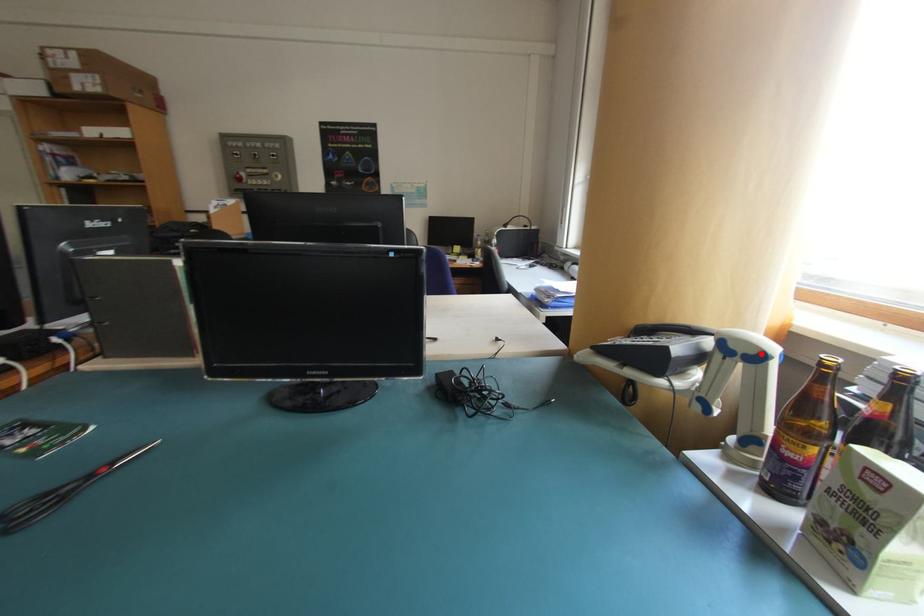
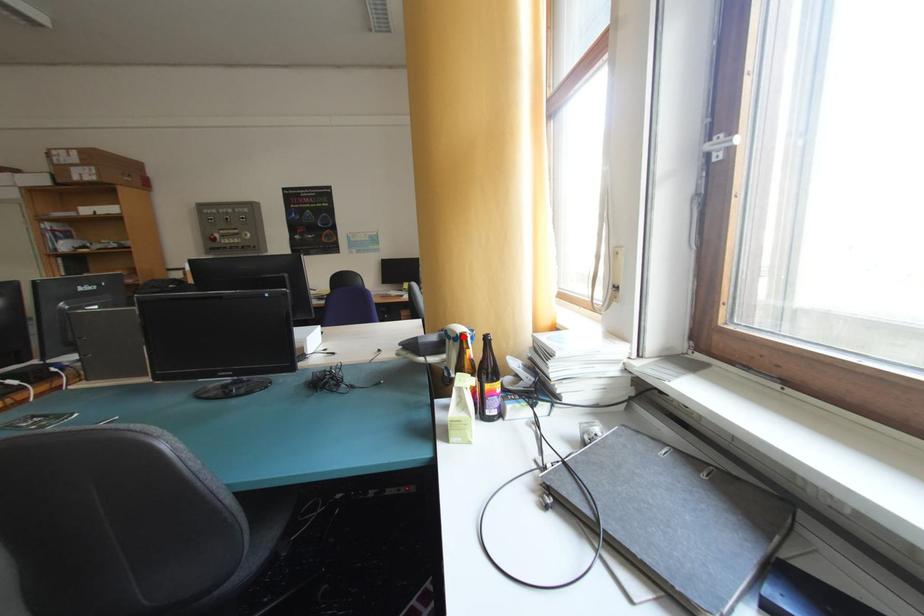
I am providing you with two images of the same scene from different viewpoints. A red point is marked on the first image and another point is marked on the second image. Do the highlighted points in image1 and image2 indicate the same real-world spot?

Yes